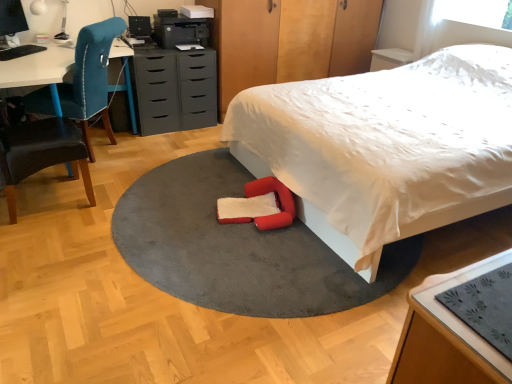
Question: Is point (466, 273) closer or farther from the camera than point (1, 127)?

Choices:
 (A) farther
 (B) closer

Answer: (B)

Question: Would you say wooden table at lower right is inside or outside velvet teal chair at left, the 1th chair viewed from the front?

Choices:
 (A) inside
 (B) outside

Answer: (B)

Question: Which object is the farthest from the soft gray carpet at center?

Choices:
 (A) wooden dresser at upper center
 (B) white soft bed at center
 (C) velvet teal chair at left, which is counted as the 1th chair, starting from the back
 (D) wooden table at lower right
 (E) white glossy table lamp at upper left

Answer: (E)

Question: Which is nearer to the wooden dresser at upper center?

Choices:
 (A) white soft bed at center
 (B) wooden table at lower right
 (C) black matte printer at upper center
 (D) white glossy table lamp at upper left
 (E) matte gray chest of drawers at center

Answer: (C)